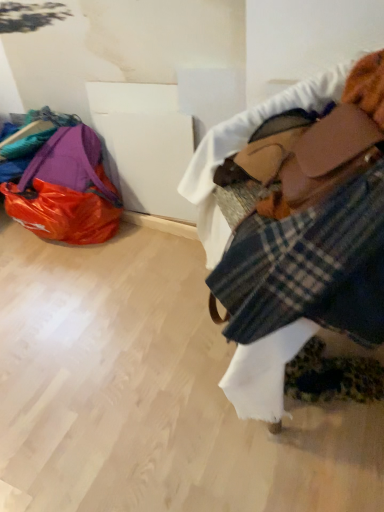
The image size is (384, 512). I want to click on vacant region to the left of plaid fabric at upper right, so click(x=127, y=360).